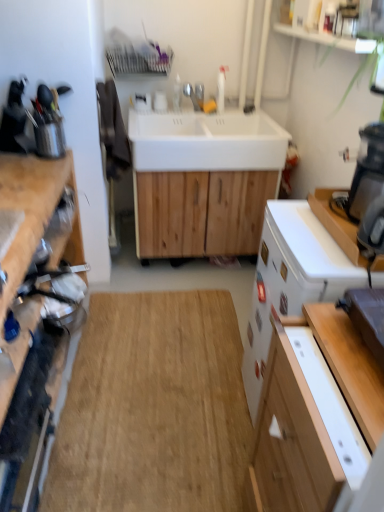
The height and width of the screenshot is (512, 384). I want to click on vacant point above wooden cutting board at left, the 2th cabinetry in the right-to-left sequence (from a real-world perspective), so click(24, 179).